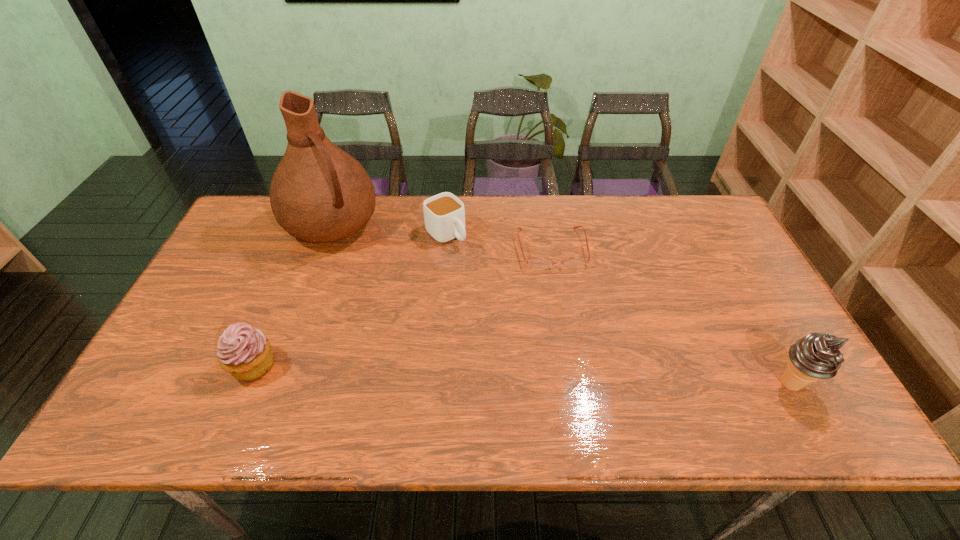
Identify the location of free space located 0.120m on the lenses of the fourth object from left to right. (564, 303).

The image size is (960, 540). In order to click on vacant position located on the lenses of the fourth object from left to right in this screenshot , I will do `click(572, 339)`.

Where is `vacant space located on the lenses of the fourth object from left to right`? Image resolution: width=960 pixels, height=540 pixels. vacant space located on the lenses of the fourth object from left to right is located at coordinates (570, 329).

What are the coordinates of `free region located on the side with the handle of the fourth tallest object` in the screenshot? It's located at (485, 274).

Image resolution: width=960 pixels, height=540 pixels. What are the coordinates of `vacant space situated on the side with the handle of the fourth tallest object` in the screenshot? It's located at (507, 295).

I want to click on free space located on the side with the handle of the fourth tallest object, so (471, 260).

The width and height of the screenshot is (960, 540). In order to click on free region located on the side of the tallest object with the handle in this screenshot , I will do click(398, 310).

Identify the location of free space located on the side of the tallest object with the handle. (392, 301).

I want to click on free point located 0.350m on the side of the tallest object with the handle, so click(410, 325).

Where is `spectacles that is at the far edge`? The width and height of the screenshot is (960, 540). spectacles that is at the far edge is located at coordinates (538, 263).